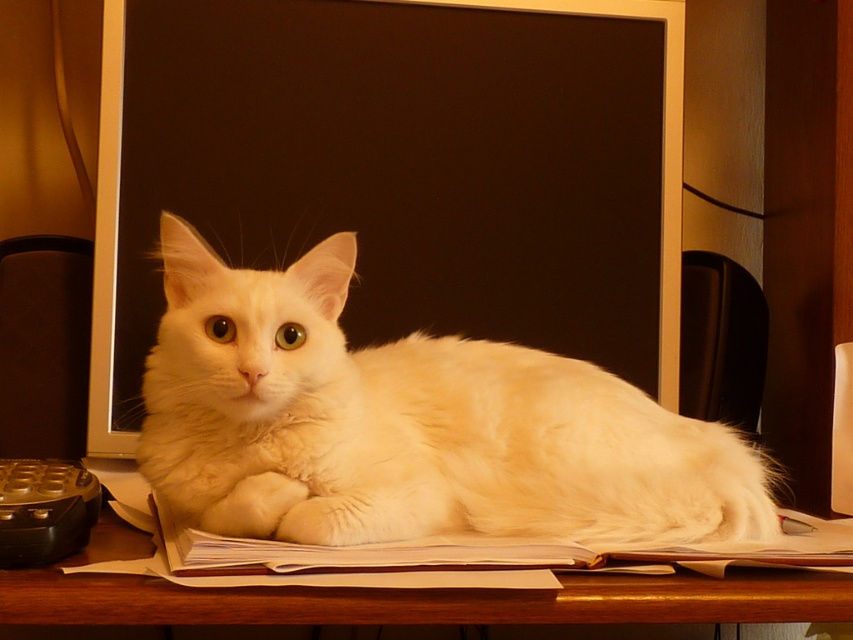
Does black matte computer screen at center appear on the right side of wooden table at lower center?

No, black matte computer screen at center is not to the right of wooden table at lower center.

Who is higher up, black matte computer screen at center or wooden table at lower center?

black matte computer screen at center

Is point (608, 298) closer to viewer compared to point (102, 589)?

No, (608, 298) is further to viewer.

Where is `black matte computer screen at center`? black matte computer screen at center is located at coordinates (399, 170).

Can you confirm if white fluffy cat at center is bigger than wooden table at lower center?

Yes, white fluffy cat at center is bigger than wooden table at lower center.

Does white fluffy cat at center lie behind wooden table at lower center?

That is True.

You are a GUI agent. You are given a task and a screenshot of the screen. Output one action in this format:
    pyautogui.click(x=<x>, y=<y>)
    Task: Click on the white fluffy cat at center
    
    Given the screenshot: What is the action you would take?
    pyautogui.click(x=408, y=426)

Which is below, black matte computer screen at center or white fluffy cat at center?

white fluffy cat at center is lower down.

Does point (410, 131) lie behind point (584, 531)?

Yes, point (410, 131) is behind point (584, 531).

Where is `black matte computer screen at center`? black matte computer screen at center is located at coordinates (399, 170).